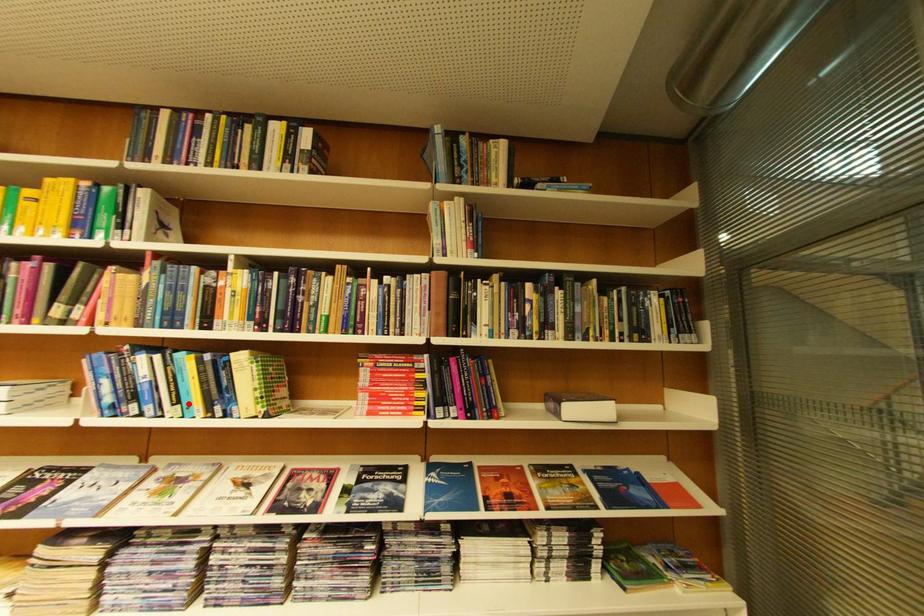
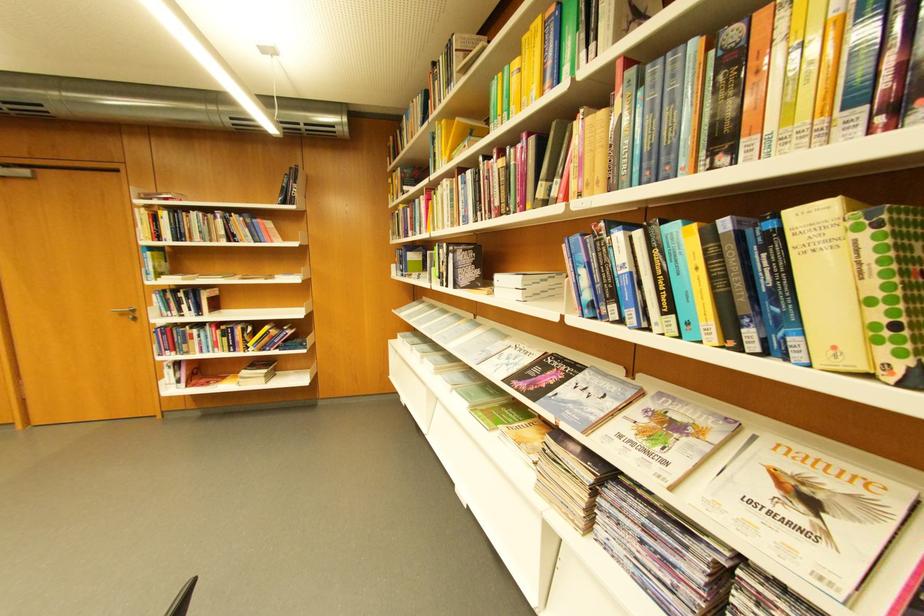
Where in the second image is the point corresponding to the highlighted location from the first image?

(681, 310)